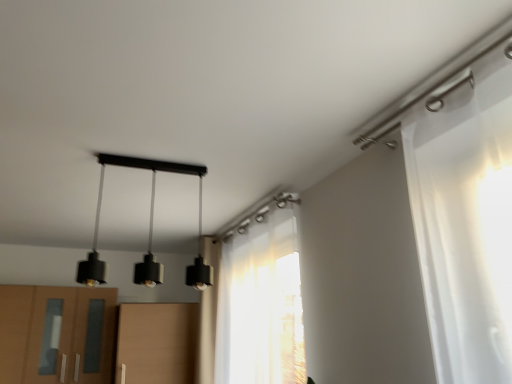
Question: Are translucent white curtain at center and black matte pendant lights at center far apart?

Choices:
 (A) no
 (B) yes

Answer: (A)

Question: Is translucent white curtain at center directly adjacent to black matte pendant lights at center?

Choices:
 (A) no
 (B) yes

Answer: (A)

Question: Is translucent white curtain at center positioned behind black matte pendant lights at center?

Choices:
 (A) no
 (B) yes

Answer: (B)

Question: Could you tell me if translucent white curtain at center is turned towards black matte pendant lights at center?

Choices:
 (A) yes
 (B) no

Answer: (A)

Question: Considering the relative positions of translucent white curtain at center and black matte pendant lights at center in the image provided, is translucent white curtain at center to the left of black matte pendant lights at center from the viewer's perspective?

Choices:
 (A) no
 (B) yes

Answer: (A)

Question: In terms of width, does black matte pendant lights at center look wider or thinner when compared to translucent white curtain at center?

Choices:
 (A) thin
 (B) wide

Answer: (B)

Question: Is black matte pendant lights at center situated inside translucent white curtain at center or outside?

Choices:
 (A) outside
 (B) inside

Answer: (A)

Question: In the image, is black matte pendant lights at center positioned in front of or behind translucent white curtain at center?

Choices:
 (A) front
 (B) behind

Answer: (A)

Question: Considering the positions of black matte pendant lights at center and translucent white curtain at center in the image, is black matte pendant lights at center taller or shorter than translucent white curtain at center?

Choices:
 (A) tall
 (B) short

Answer: (B)

Question: From a real-world perspective, is matte brown cabinet at lower left above or below black matte pendant lights at center?

Choices:
 (A) below
 (B) above

Answer: (A)

Question: In terms of height, does matte brown cabinet at lower left look taller or shorter compared to black matte pendant lights at center?

Choices:
 (A) short
 (B) tall

Answer: (B)

Question: Relative to black matte pendant lights at center, is matte brown cabinet at lower left in front or behind?

Choices:
 (A) front
 (B) behind

Answer: (B)

Question: Is point (41, 296) closer or farther from the camera than point (176, 172)?

Choices:
 (A) closer
 (B) farther

Answer: (B)

Question: In the image, is matte brown cabinet at lower left on the left side or the right side of translucent white curtain at center?

Choices:
 (A) right
 (B) left

Answer: (B)

Question: In the image, is matte brown cabinet at lower left positioned in front of or behind translucent white curtain at center?

Choices:
 (A) behind
 (B) front

Answer: (A)